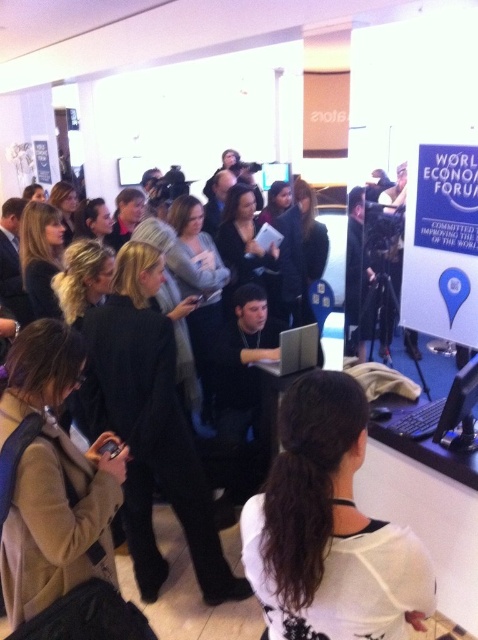
Can you confirm if white matte shirt at center is smaller than silver metallic laptop at center?

Incorrect, white matte shirt at center is not smaller in size than silver metallic laptop at center.

Is white matte shirt at center positioned at the back of silver metallic laptop at center?

No, white matte shirt at center is in front of silver metallic laptop at center.

Who is more forward, (413, 538) or (304, 324)?

Point (413, 538)

You are a GUI agent. You are given a task and a screenshot of the screen. Output one action in this format:
    pyautogui.click(x=<x>, y=<y>)
    Task: Click on the white matte shirt at center
    Image resolution: width=478 pixels, height=640 pixels.
    Given the screenshot: What is the action you would take?
    pyautogui.click(x=328, y=529)